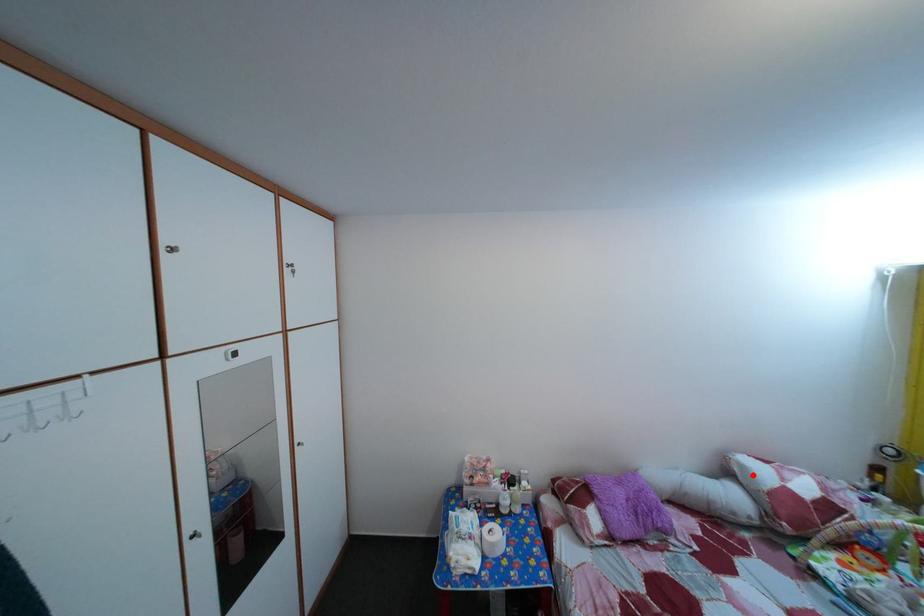
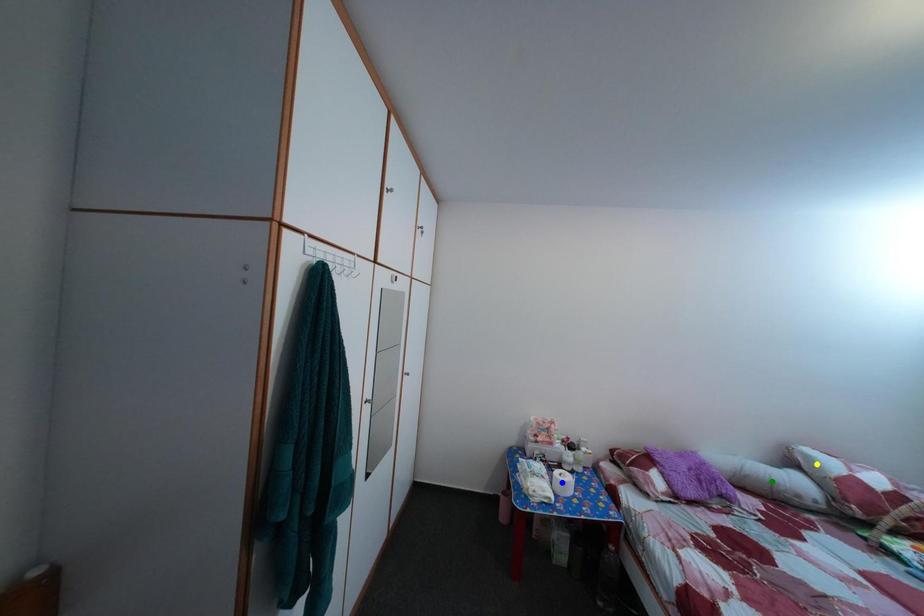
Question: I am providing you with two images of the same scene from different viewpoints. A red point is marked on the first image. You are given multiple points on the second image. Which point in image 2 represents the same 3d spot as the red point in image 1?

Choices:
 (A) yellow point
 (B) green point
 (C) blue point

Answer: (A)